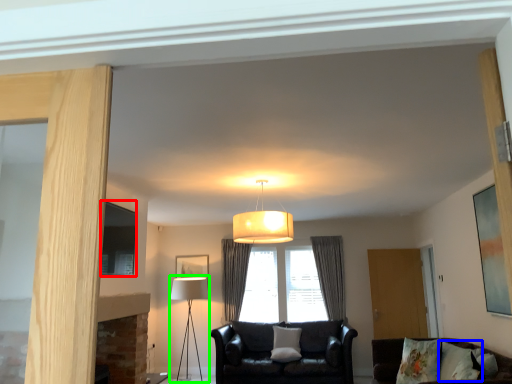
Question: Considering the real-world distances, which object is closest to picture frame (highlighted by a red box)? pillow (highlighted by a blue box) or table lamp (highlighted by a green box).

Choices:
 (A) pillow
 (B) table lamp

Answer: (B)